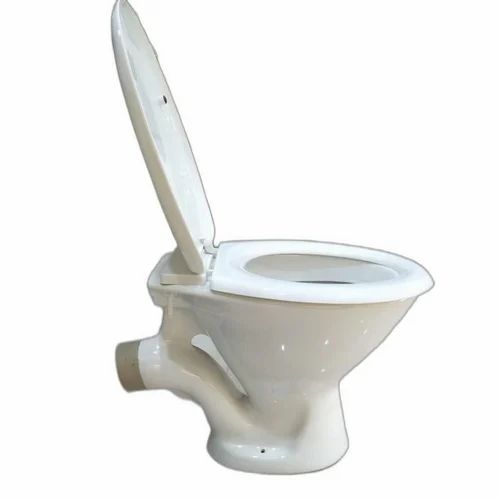
Find the location of a particular element. This screenshot has width=500, height=500. toilet lid is located at coordinates (166, 151).